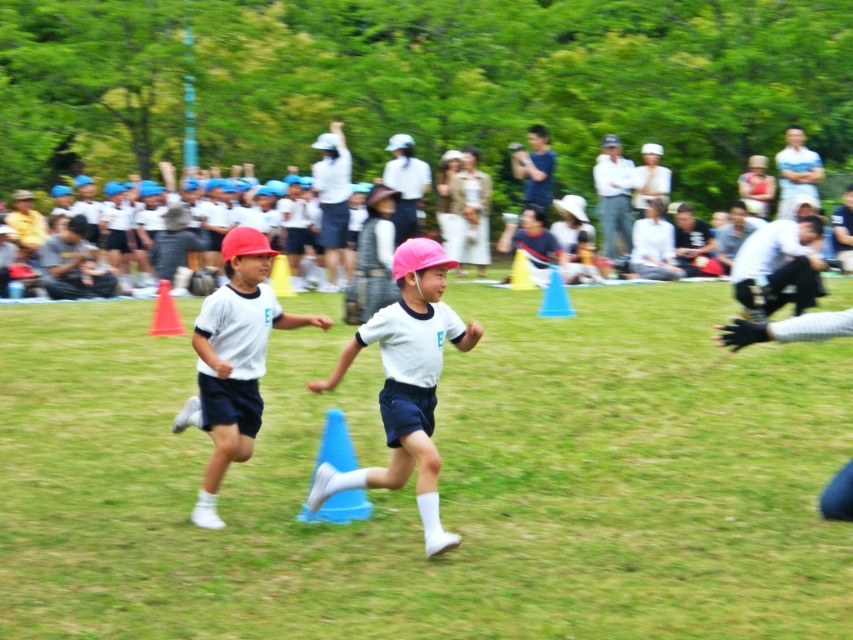
Does white cotton crowd at upper center have a lesser width compared to white matte shirt at center?

No.

Between white cotton crowd at upper center and white matte shirt at center, which one has less height?

white matte shirt at center

Is point (167, 170) positioned behind point (247, 244)?

Yes, it is behind point (247, 244).

This screenshot has width=853, height=640. Identify the location of white cotton crowd at upper center. (86, 291).

Between white matte shirt at center and blue plastic cone at center, which one appears on the right side from the viewer's perspective?

blue plastic cone at center is more to the right.

Which is above, white matte shirt at center or blue plastic cone at center?

Positioned higher is white matte shirt at center.

Does point (192, 417) come behind point (332, 422)?

Yes, point (192, 417) is farther from viewer.

The width and height of the screenshot is (853, 640). What are the coordinates of `white matte shirt at center` in the screenshot? It's located at (234, 358).

Which of these two, green grass at center or white matte helmet at center, stands taller?

With more height is white matte helmet at center.

Between point (418, 554) and point (424, 477), which one is positioned behind?

Positioned behind is point (424, 477).

At what (x,y) coordinates should I click in order to perform the action: click on green grass at center. Please return your answer as a coordinate pair (x, y). This screenshot has width=853, height=640. Looking at the image, I should click on (439, 481).